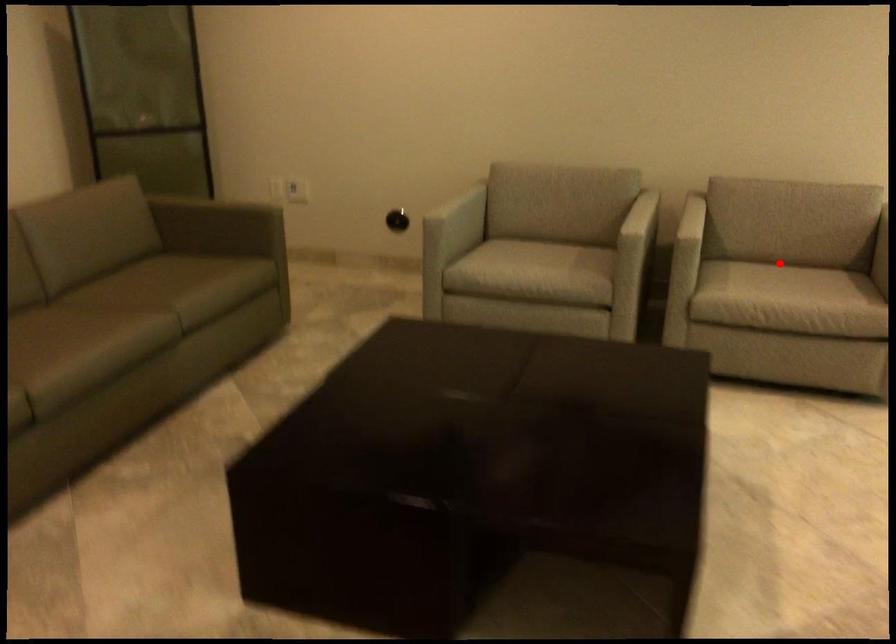
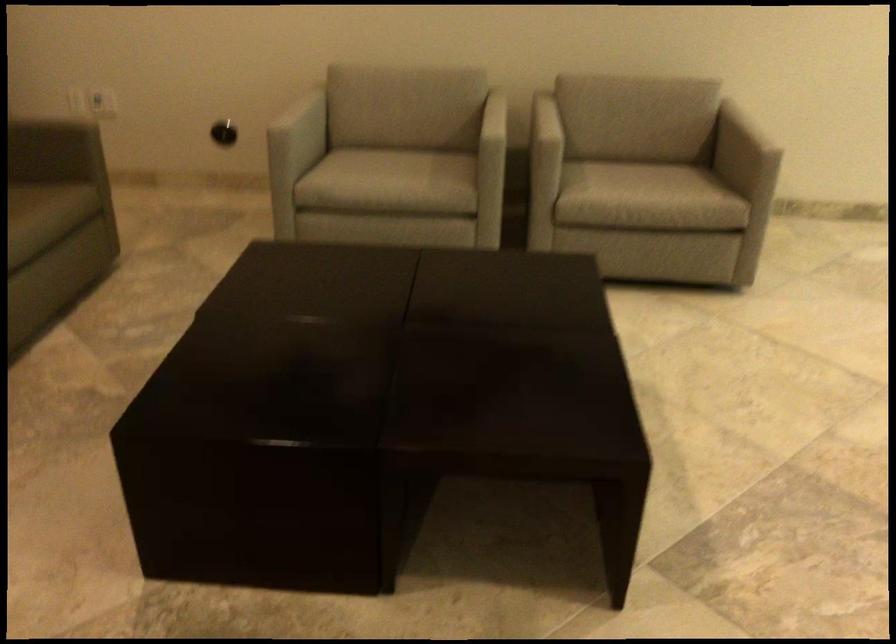
Find the pixel in the second image that matches the highlighted location in the first image.

(633, 160)